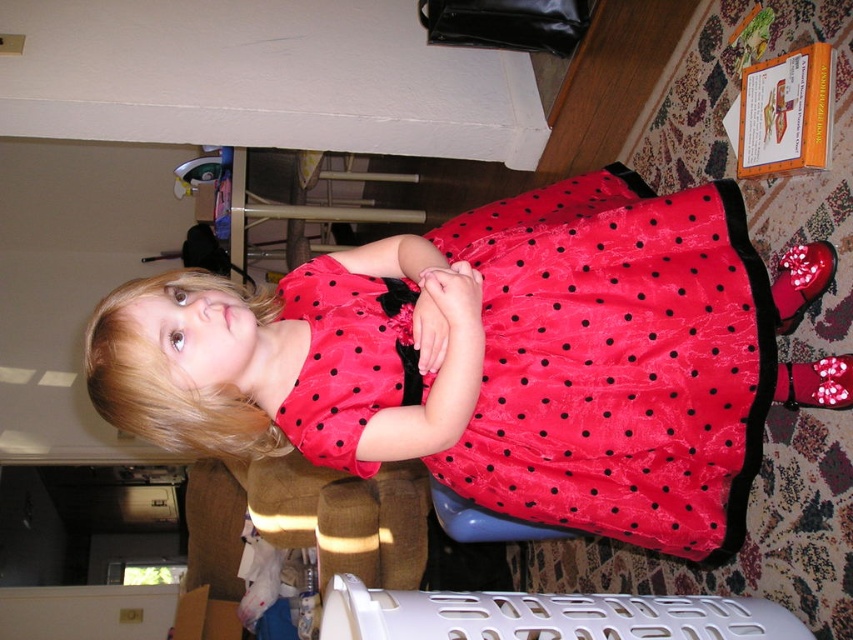
Question: In this image, where is red satin dress at center located relative to white plastic laundry basket at lower center?

Choices:
 (A) left
 (B) right

Answer: (A)

Question: Can you confirm if red satin dress at center is thinner than white plastic laundry basket at lower center?

Choices:
 (A) no
 (B) yes

Answer: (A)

Question: Can you confirm if red satin dress at center is positioned below white plastic laundry basket at lower center?

Choices:
 (A) no
 (B) yes

Answer: (A)

Question: Which point is farther from the camera taking this photo?

Choices:
 (A) (701, 460)
 (B) (438, 632)

Answer: (A)

Question: Which point is farther to the camera?

Choices:
 (A) (701, 486)
 (B) (476, 624)

Answer: (A)